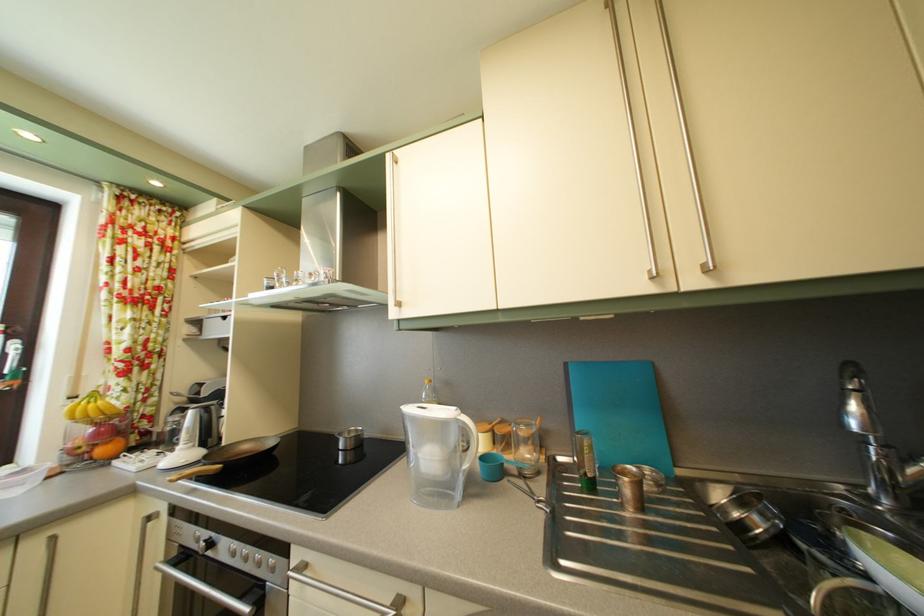
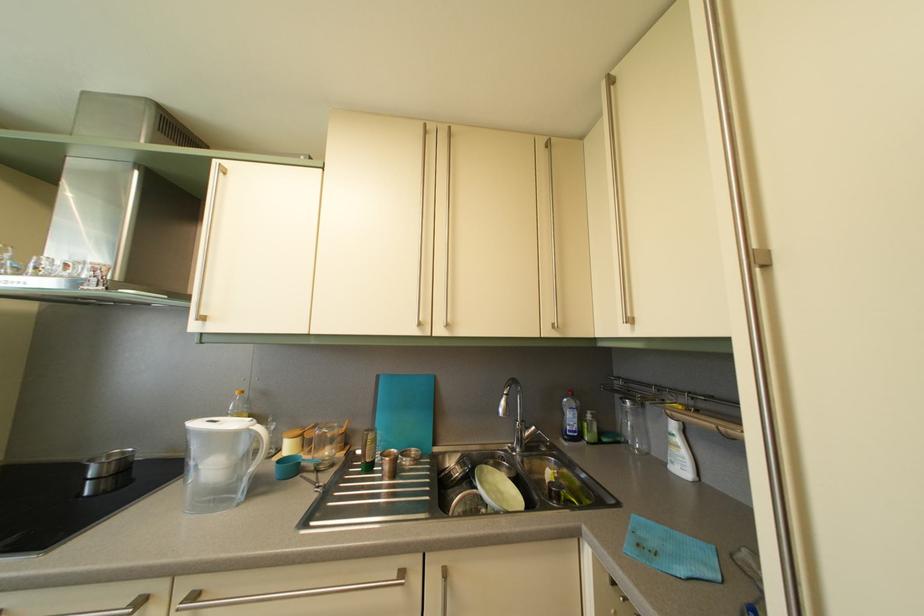
In the second image, find the point that corresponds to (358,439) in the first image.

(118, 463)